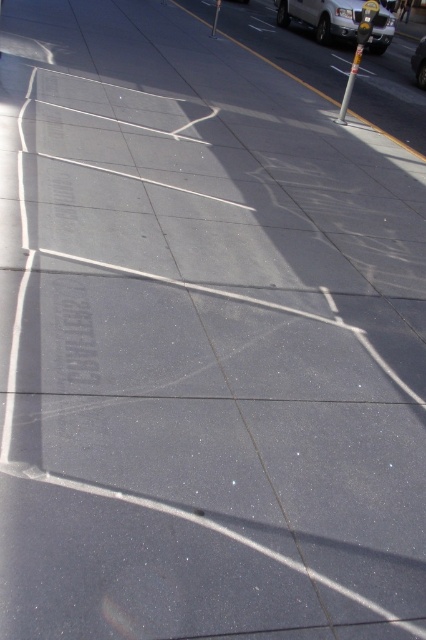
Question: Does white glossy van at upper right appear on the left side of metallic silver car at upper right?

Choices:
 (A) no
 (B) yes

Answer: (B)

Question: Which of the following is the closest to the observer?

Choices:
 (A) (425, 67)
 (B) (345, 29)

Answer: (A)

Question: Among these objects, which one is nearest to the camera?

Choices:
 (A) white glossy van at upper right
 (B) metallic silver car at upper right

Answer: (B)

Question: Does white glossy van at upper right appear on the right side of metallic silver car at upper right?

Choices:
 (A) no
 (B) yes

Answer: (A)

Question: From the image, what is the correct spatial relationship of white glossy van at upper right in relation to metallic silver car at upper right?

Choices:
 (A) below
 (B) above

Answer: (B)

Question: Which object is closer to the camera taking this photo?

Choices:
 (A) metallic silver car at upper right
 (B) white glossy van at upper right

Answer: (A)